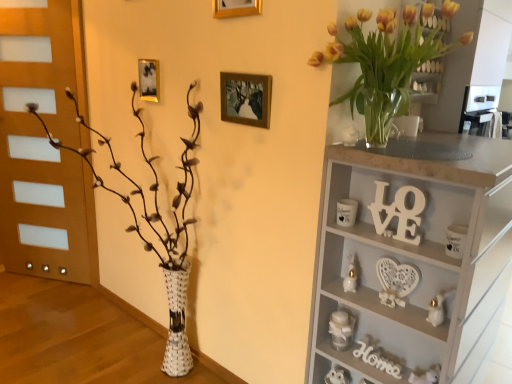
Describe the element at coordinates (399, 212) in the screenshot. The image size is (512, 384). I see `white wooden sign at upper right` at that location.

Describe the element at coordinates (413, 259) in the screenshot. The image size is (512, 384). I see `white wood shelf at upper right` at that location.

The image size is (512, 384). Identify the location of translucent glass vase at upper right. (382, 66).

In the scene shown: What is the approximate width of gold metallic picture frame at upper center, which ranks as the 1th picture frame in front-to-back order?

It is 0.93 inches.

Measure the distance between point [183,330] and camera.

Point [183,330] and camera are 6.74 feet apart from each other.

The width and height of the screenshot is (512, 384). Find the location of `gold metallic picture frame at upper center, which is the 2th picture frame from top to bottom`. gold metallic picture frame at upper center, which is the 2th picture frame from top to bottom is located at coordinates (149, 80).

Between translucent glass vase at upper right and gold metallic picture frame at upper center, which is the 1th picture frame from back to front, which one has smaller width?

gold metallic picture frame at upper center, which is the 1th picture frame from back to front.

Considering the positions of point (394, 63) and point (150, 60), is point (394, 63) closer or farther from the camera than point (150, 60)?

Point (394, 63) is closer to the camera than point (150, 60).

Would you say translucent glass vase at upper right is inside or outside gold metallic picture frame at upper center, which is the 2th picture frame from top to bottom?

translucent glass vase at upper right is spatially situated outside gold metallic picture frame at upper center, which is the 2th picture frame from top to bottom.

Between translucent glass vase at upper right and gold metallic picture frame at upper center, which appears as the first picture frame when viewed from the left, which one has smaller size?

With smaller size is gold metallic picture frame at upper center, which appears as the first picture frame when viewed from the left.

Identify the location of floral arrangement that appears above the white wood shelf at upper right (from the image's perspective). (382, 66).

Would you say translucent glass vase at upper right is a long distance from white wood shelf at upper right?

translucent glass vase at upper right is actually quite close to white wood shelf at upper right.

Which point is more distant from viewer, (375, 35) or (371, 253)?

The point (371, 253) is farther.

Who is taller, translucent glass vase at upper right or white wood shelf at upper right?

With more height is white wood shelf at upper right.

Is wooden picture frame at center, which is the second picture frame in back-to-front order, surrounding translucent glass vase at upper right?

Definitely not — translucent glass vase at upper right is not inside wooden picture frame at center, which is the second picture frame in back-to-front order.

Is wooden picture frame at center, the first picture frame ordered from the bottom, facing towards translucent glass vase at upper right?

No, wooden picture frame at center, the first picture frame ordered from the bottom, is not facing towards translucent glass vase at upper right.

Which of these two, wooden picture frame at center, the first picture frame ordered from the bottom, or translucent glass vase at upper right, is thinner?

With smaller width is wooden picture frame at center, the first picture frame ordered from the bottom.

Is gold metallic picture frame at upper center, which appears as the third picture frame when viewed from the right, at the right side of white woven vase at left?

Correct, you'll find gold metallic picture frame at upper center, which appears as the third picture frame when viewed from the right, to the right of white woven vase at left.

Which object is thinner, gold metallic picture frame at upper center, which is the 2th picture frame from top to bottom, or white woven vase at left?

gold metallic picture frame at upper center, which is the 2th picture frame from top to bottom, is thinner.

From the image's perspective, is gold metallic picture frame at upper center, which appears as the third picture frame when viewed from the right, located above or below white woven vase at left?

Based on their image positions, gold metallic picture frame at upper center, which appears as the third picture frame when viewed from the right, is located above white woven vase at left.

Considering the sizes of gold metallic picture frame at upper center, which is the 1th picture frame from back to front, and white woven vase at left in the image, is gold metallic picture frame at upper center, which is the 1th picture frame from back to front, taller or shorter than white woven vase at left?

Considering their sizes, gold metallic picture frame at upper center, which is the 1th picture frame from back to front, has less height than white woven vase at left.

Does point (378, 32) come behind point (229, 73)?

That is False.

Is translucent glass vase at upper right oriented towards wooden picture frame at center, arranged as the 1th picture frame when viewed from the right?

No.

Is the depth of translucent glass vase at upper right greater than that of wooden picture frame at center, which is the second picture frame in back-to-front order?

That is False.

From the image's perspective, which is above, translucent glass vase at upper right or wooden picture frame at center, which is the second picture frame in back-to-front order?

translucent glass vase at upper right is shown above in the image.

Does gold metallic picture frame at upper center, marked as the second picture frame in a right-to-left arrangement, appear on the left side of white wood shelf at upper right?

Indeed, gold metallic picture frame at upper center, marked as the second picture frame in a right-to-left arrangement, is positioned on the left side of white wood shelf at upper right.

Looking at their sizes, would you say gold metallic picture frame at upper center, which ranks as the 1th picture frame in front-to-back order, is wider or thinner than white wood shelf at upper right?

Considering their sizes, gold metallic picture frame at upper center, which ranks as the 1th picture frame in front-to-back order, looks slimmer than white wood shelf at upper right.

Does gold metallic picture frame at upper center, the 3th picture frame ordered from the bottom, turn towards white wood shelf at upper right?

No, gold metallic picture frame at upper center, the 3th picture frame ordered from the bottom, is not facing towards white wood shelf at upper right.

Between gold metallic picture frame at upper center, marked as the second picture frame in a left-to-right arrangement, and white wood shelf at upper right, which one has less height?

gold metallic picture frame at upper center, marked as the second picture frame in a left-to-right arrangement, is shorter.

Is the depth of white wooden sign at upper right less than that of white wood shelf at upper right?

No, it is behind white wood shelf at upper right.

Considering the sizes of white wooden sign at upper right and white wood shelf at upper right in the image, is white wooden sign at upper right wider or thinner than white wood shelf at upper right?

Considering their sizes, white wooden sign at upper right looks slimmer than white wood shelf at upper right.

Is white wooden sign at upper right to the left of white wood shelf at upper right from the viewer's perspective?

Yes.

Locate an element on the screen. This screenshot has width=512, height=384. floral arrangement above the gold metallic picture frame at upper center, which is the 1th picture frame from back to front (from a real-world perspective) is located at coordinates (382, 66).

The height and width of the screenshot is (384, 512). I want to click on shelf that is under the translucent glass vase at upper right (from a real-world perspective), so click(413, 259).

When comparing their distances from white wood shelf at upper right, does white woven vase at left or white wooden sign at upper right seem further?

white woven vase at left lies further to white wood shelf at upper right than the other object.

Based on their spatial positions, is wooden picture frame at center, the first picture frame ordered from the bottom, or white woven vase at left closer to translucent glass vase at upper right?

Based on the image, wooden picture frame at center, the first picture frame ordered from the bottom, appears to be nearer to translucent glass vase at upper right.

In the scene shown: Looking at the image, which one is located further to gold metallic picture frame at upper center, marked as the second picture frame in a left-to-right arrangement, translucent glass vase at upper right or white woven vase at left?

white woven vase at left lies further to gold metallic picture frame at upper center, marked as the second picture frame in a left-to-right arrangement, than the other object.

Which object lies nearer to the anchor point gold metallic picture frame at upper center, the 3th picture frame ordered from the bottom, gold metallic picture frame at upper center, which appears as the first picture frame when viewed from the left, or wooden picture frame at center, arranged as the second picture frame when viewed from the front?

The object closer to gold metallic picture frame at upper center, the 3th picture frame ordered from the bottom, is wooden picture frame at center, arranged as the second picture frame when viewed from the front.

When comparing their distances from white woven vase at left, does wooden picture frame at center, placed as the 3th picture frame when sorted from top to bottom, or gold metallic picture frame at upper center, which appears as the first picture frame when viewed from the left, seem further?

gold metallic picture frame at upper center, which appears as the first picture frame when viewed from the left, is positioned further to the anchor white woven vase at left.

Looking at the image, which one is located further to translucent glass vase at upper right, wooden picture frame at center, acting as the 3th picture frame starting from the left, or gold metallic picture frame at upper center, which appears as the third picture frame when viewed from the right?

gold metallic picture frame at upper center, which appears as the third picture frame when viewed from the right, is positioned further to the anchor translucent glass vase at upper right.

From the image, which object appears to be farther from white wooden sign at upper right, white woven vase at left or gold metallic picture frame at upper center, which appears as the third picture frame when viewed from the right?

gold metallic picture frame at upper center, which appears as the third picture frame when viewed from the right, lies further to white wooden sign at upper right than the other object.

From the image, which object appears to be nearer to wooden picture frame at center, placed as the 3th picture frame when sorted from top to bottom, white wooden sign at upper right or translucent glass vase at upper right?

Among the two, translucent glass vase at upper right is located nearer to wooden picture frame at center, placed as the 3th picture frame when sorted from top to bottom.

Find the location of a particular element. The height and width of the screenshot is (384, 512). floral arrangement situated between wooden picture frame at center, arranged as the 1th picture frame when viewed from the right, and white wooden sign at upper right from left to right is located at coordinates (382, 66).

The height and width of the screenshot is (384, 512). I want to click on picture frame between gold metallic picture frame at upper center, marked as the second picture frame in a right-to-left arrangement, and gold metallic picture frame at upper center, which is the 2th picture frame from top to bottom, along the z-axis, so click(246, 98).

Image resolution: width=512 pixels, height=384 pixels. In order to click on number between gold metallic picture frame at upper center, the 3th picture frame viewed from the back, and white wood shelf at upper right vertically in this screenshot , I will do `click(399, 212)`.

At what (x,y) coordinates should I click in order to perform the action: click on floral arrangement between gold metallic picture frame at upper center, the 3th picture frame viewed from the back, and white wood shelf at upper right in the up-down direction. Please return your answer as a coordinate pair (x, y). Looking at the image, I should click on (382, 66).